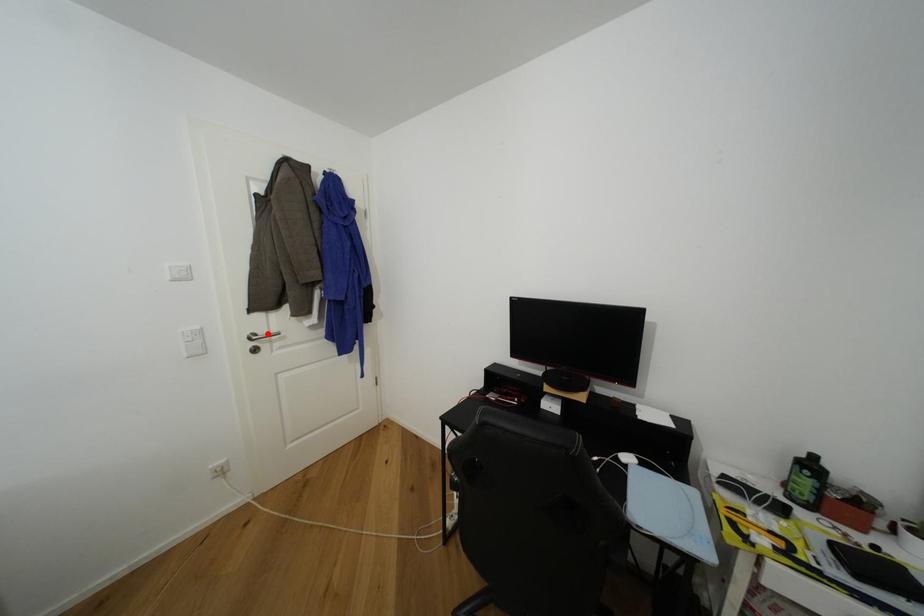
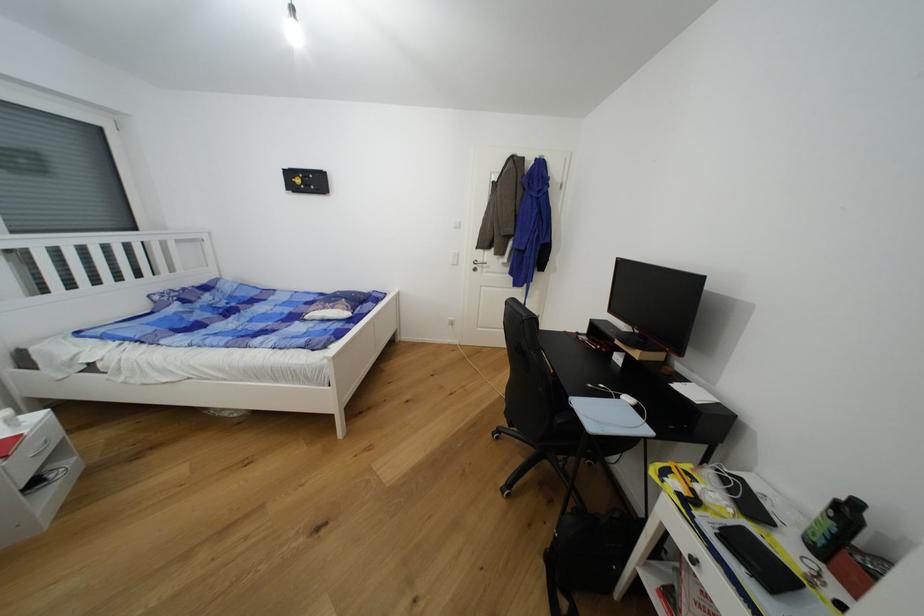
Find the pixel in the second image that matches the highlighted location in the first image.

(484, 262)